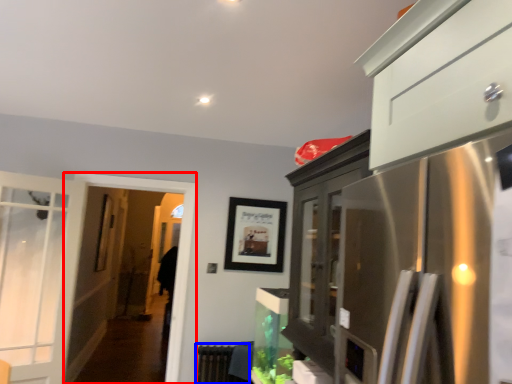
Question: Which of the following is the farthest to the observer, screen door (highlighted by a red box) or radiator (highlighted by a blue box)?

Choices:
 (A) screen door
 (B) radiator

Answer: (B)